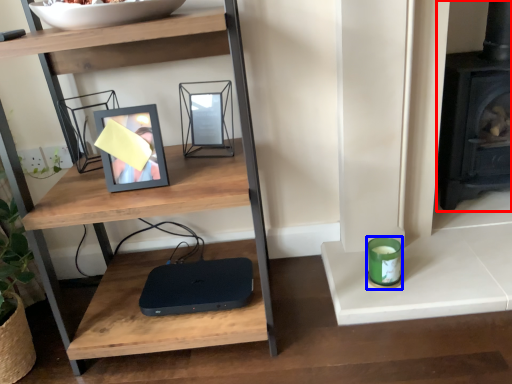
Question: Which point is closer to the camera, fireplace (highlighted by a red box) or candle holder (highlighted by a blue box)?

Choices:
 (A) fireplace
 (B) candle holder

Answer: (B)